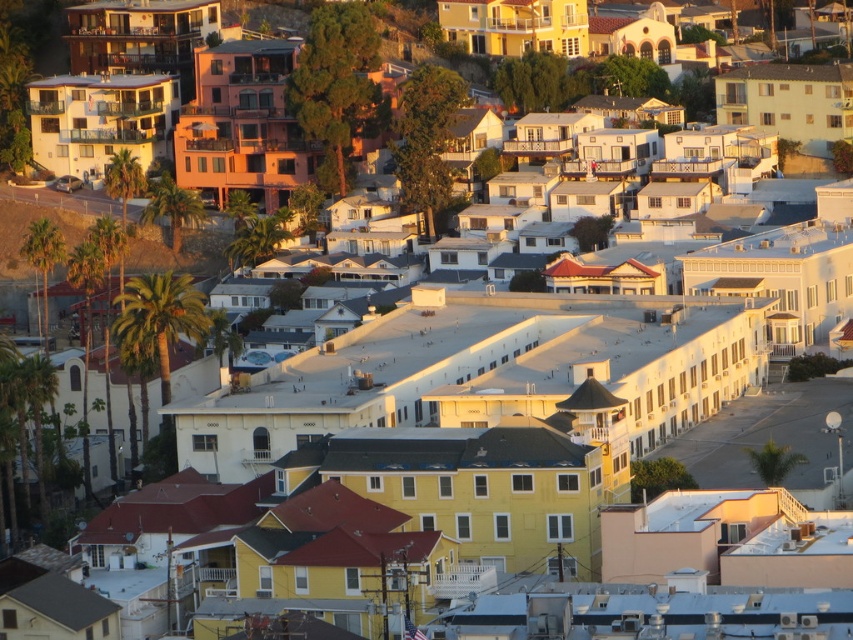
Question: Estimate the real-world distances between objects in this image. Which object is farther from the green leafy palm tree at center-left?

Choices:
 (A) green leafy palm tree at lower left
 (B) green leafy palm tree at left
 (C) green leafy palm trees at left

Answer: (A)

Question: Which of these objects is positioned closest to the green leafy palm trees at left?

Choices:
 (A) green leafy palm tree at center-left
 (B) green leafy palm tree at left
 (C) green leafy palm tree at lower left

Answer: (A)

Question: Does green leafy palm tree at left appear under green leafy palm tree at center-left?

Choices:
 (A) yes
 (B) no

Answer: (A)

Question: Is green leafy palm tree at left above green leafy palm tree at center-left?

Choices:
 (A) no
 (B) yes

Answer: (A)

Question: Which object is positioned closest to the green leafy palm trees at left?

Choices:
 (A) green leafy palm tree at lower left
 (B) green leafy palm tree at left

Answer: (B)

Question: Is green leafy palm tree at lower left above green leafy palm tree at left?

Choices:
 (A) no
 (B) yes

Answer: (A)